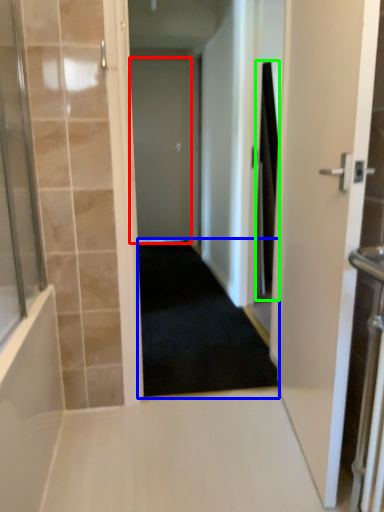
Question: Estimate the real-world distances between objects in this image. Which object is farther from door (highlighted by a red box), corridor (highlighted by a blue box) or shower curtain (highlighted by a green box)?

Choices:
 (A) corridor
 (B) shower curtain

Answer: (B)